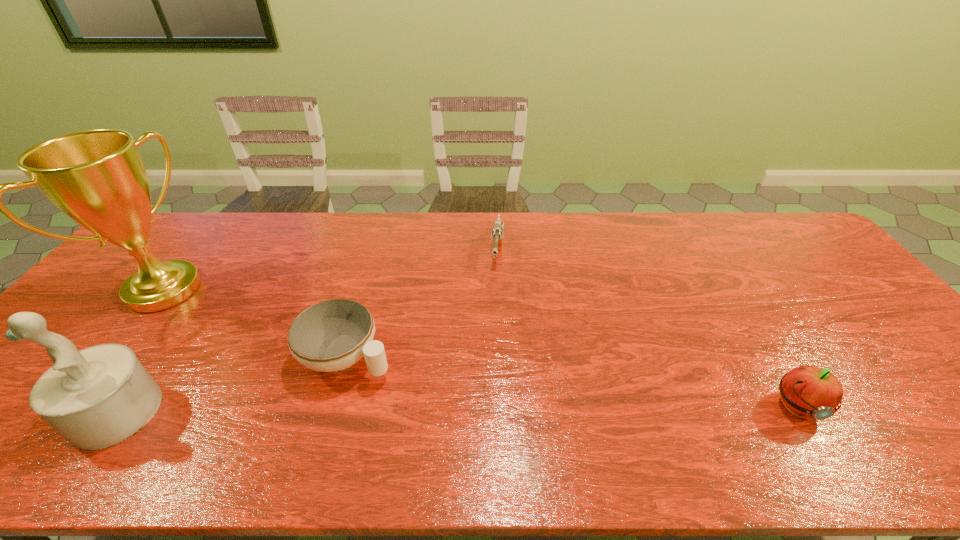
You are a GUI agent. You are given a task and a screenshot of the screen. Output one action in this format:
    pyautogui.click(x=<x>, y=<y>)
    Task: Click on the object that is at the left edge
    
    Given the screenshot: What is the action you would take?
    (x=96, y=177)

In the image, there is a desktop. Where is `vacant space at the far edge`? The image size is (960, 540). vacant space at the far edge is located at coordinates (229, 235).

Find the location of a particular element. free location at the right edge is located at coordinates (816, 265).

Locate an element on the screen. The image size is (960, 540). vacant space at the far left corner is located at coordinates (159, 232).

The image size is (960, 540). Identify the location of vacant space at the near left corner. (23, 396).

The height and width of the screenshot is (540, 960). What are the coordinates of `free point between the second object from right to left and the rightmost object` in the screenshot? It's located at (647, 327).

The image size is (960, 540). I want to click on blank region between the rightmost object and the award, so click(x=480, y=348).

The height and width of the screenshot is (540, 960). Identify the location of empty space between the rightmost object and the chinaware. (571, 381).

Locate an element on the screen. This screenshot has height=540, width=960. unoccupied area between the figurine and the award is located at coordinates [140, 351].

This screenshot has width=960, height=540. Find the location of `free area in between the chinaware and the gun`. free area in between the chinaware and the gun is located at coordinates (422, 302).